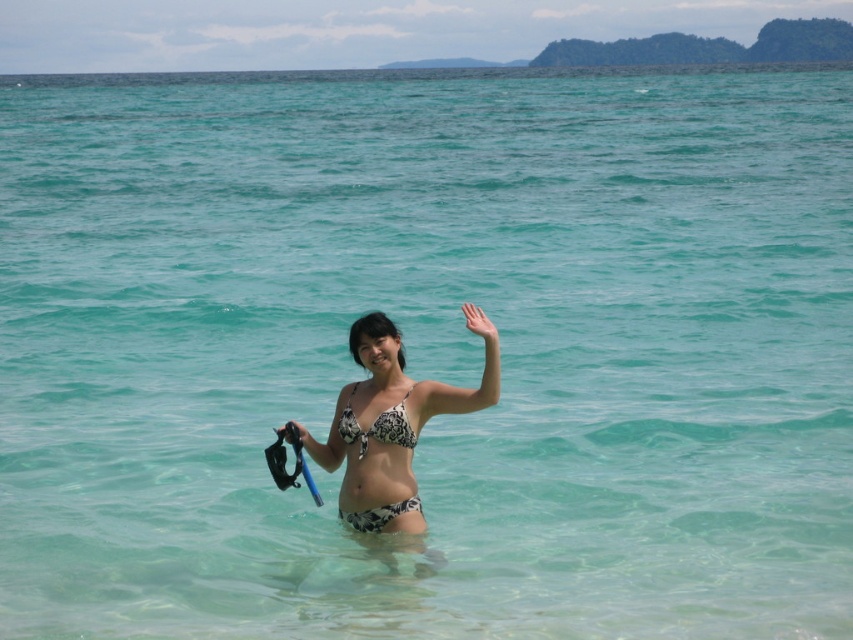
Question: Which point is farther from the camera taking this photo?

Choices:
 (A) (351, 525)
 (B) (345, 436)

Answer: (A)

Question: Which is farther from the black rubber snorkel at center?

Choices:
 (A) black printed bikini at center
 (B) blue rubber paddle at center
 (C) black printed bikini top at center
 (D) white printed bikini at center

Answer: (D)

Question: Does blue rubber paddle at center have a smaller size compared to black rubber snorkel at center?

Choices:
 (A) no
 (B) yes

Answer: (A)

Question: Which of the following is the farthest from the observer?

Choices:
 (A) (300, 438)
 (B) (273, 451)

Answer: (A)

Question: Does blue rubber paddle at center appear under black rubber snorkel at center?

Choices:
 (A) no
 (B) yes

Answer: (B)

Question: From the image, what is the correct spatial relationship of blue rubber paddle at center in relation to black rubber snorkel at center?

Choices:
 (A) right
 (B) left

Answer: (B)